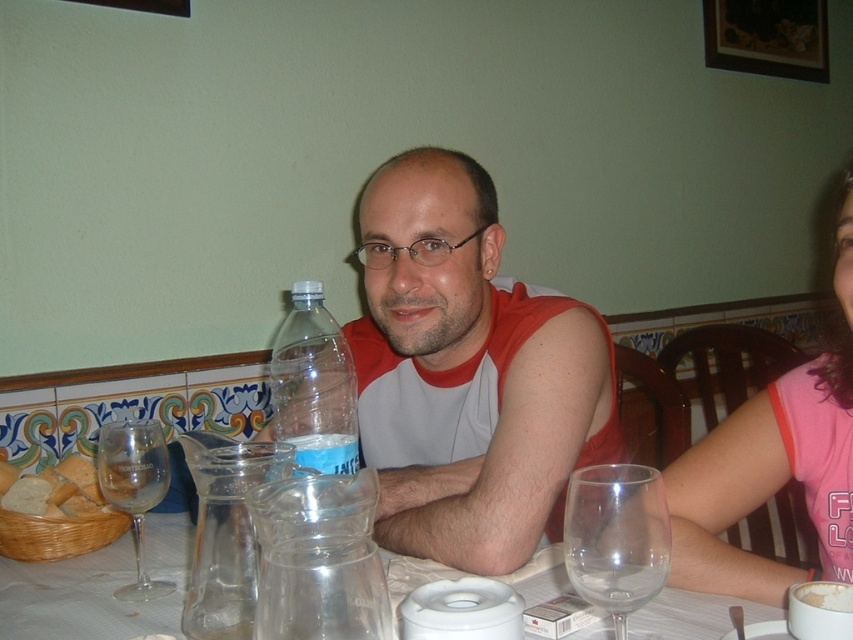
Which is more to the left, matte plastic bottle at center or transparent glass at center?

From the viewer's perspective, transparent glass at center appears more on the left side.

Does point (547, 349) come in front of point (144, 522)?

Yes, point (547, 349) is in front of point (144, 522).

Locate an element on the screen. The height and width of the screenshot is (640, 853). matte plastic bottle at center is located at coordinates (467, 372).

Does matte plastic bottle at center appear under clear plastic bottle at center?

Yes, matte plastic bottle at center is below clear plastic bottle at center.

Looking at this image, measure the distance from matte plastic bottle at center to clear plastic bottle at center.

A distance of 7.59 inches exists between matte plastic bottle at center and clear plastic bottle at center.

Between point (395, 291) and point (310, 444), which one is positioned behind?

Positioned behind is point (395, 291).

Locate an element on the screen. Image resolution: width=853 pixels, height=640 pixels. matte plastic bottle at center is located at coordinates (467, 372).

Is clear plastic bottle at center closer to the viewer compared to clear glass wine glass at left?

Yes, it is.

Is the position of clear plastic bottle at center more distant than that of clear glass wine glass at left?

No, clear plastic bottle at center is in front of clear glass wine glass at left.

Between point (277, 416) and point (138, 545), which one is positioned behind?

The point (277, 416) is behind.

Locate an element on the screen. The width and height of the screenshot is (853, 640). clear plastic bottle at center is located at coordinates (314, 385).